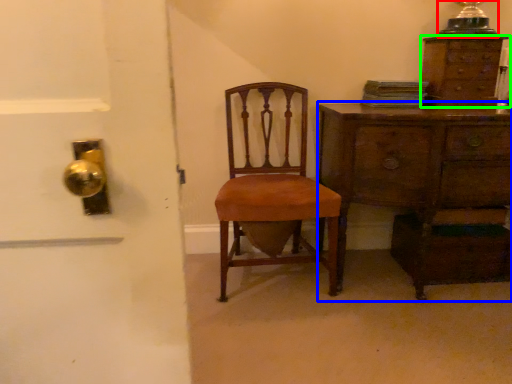
Question: Estimate the real-world distances between objects in this image. Which object is closer to table lamp (highlighted by a red box), chest of drawers (highlighted by a blue box) or chest of drawers (highlighted by a green box)?

Choices:
 (A) chest of drawers
 (B) chest of drawers

Answer: (B)